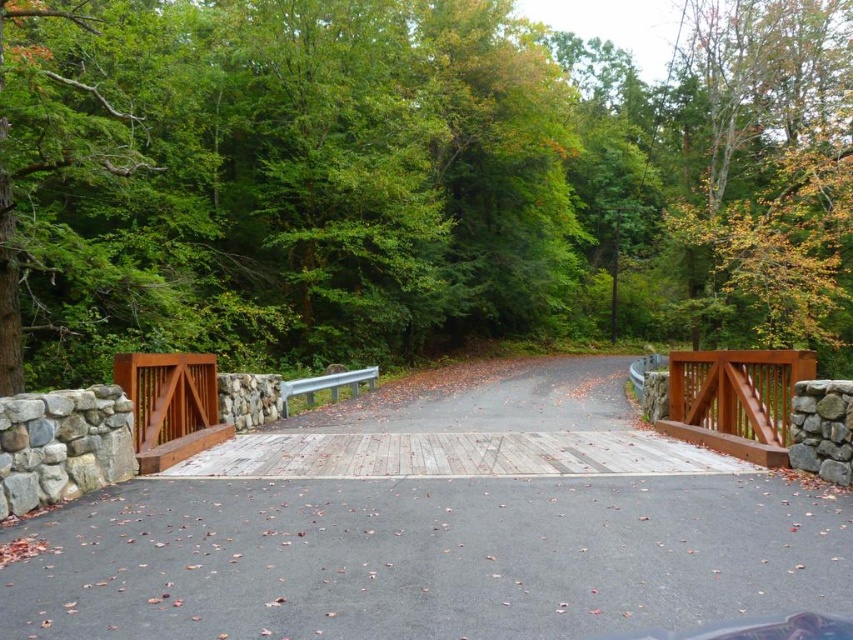
Does green leafy tree at upper center appear on the right side of smooth reddish-brown wooden gate at center?

Indeed, green leafy tree at upper center is positioned on the right side of smooth reddish-brown wooden gate at center.

In the scene shown: Is green leafy tree at upper center to the left of smooth reddish-brown wooden gate at center from the viewer's perspective?

Incorrect, green leafy tree at upper center is not on the left side of smooth reddish-brown wooden gate at center.

Which is in front, point (619, 296) or point (780, 372)?

Point (780, 372)

Locate an element on the screen. green leafy tree at upper center is located at coordinates (412, 180).

Is smooth reddish-brown wooden gate at center bigger than brown wooden gate at center-left?

Actually, smooth reddish-brown wooden gate at center might be smaller than brown wooden gate at center-left.

Which of these two, smooth reddish-brown wooden gate at center or brown wooden gate at center-left, stands shorter?

Standing shorter between the two is smooth reddish-brown wooden gate at center.

I want to click on smooth reddish-brown wooden gate at center, so (735, 401).

Does point (263, 260) come farther from viewer compared to point (201, 417)?

Yes, it is behind point (201, 417).

Between green leafy tree at upper center and brown wooden gate at center-left, which one has less height?

With less height is brown wooden gate at center-left.

Which is in front, point (103, 134) or point (155, 396)?

Positioned in front is point (155, 396).

You are a GUI agent. You are given a task and a screenshot of the screen. Output one action in this format:
    pyautogui.click(x=<x>, y=<y>)
    Task: Click on the green leafy tree at upper center
    This screenshot has height=640, width=853.
    Given the screenshot: What is the action you would take?
    pyautogui.click(x=412, y=180)